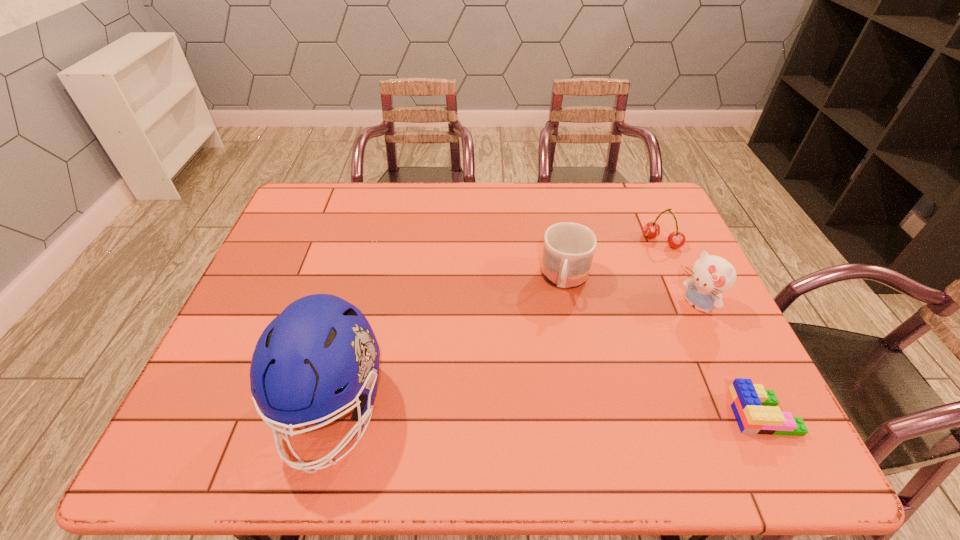
Find the location of `the tallest object`. the tallest object is located at coordinates (320, 355).

The image size is (960, 540). Find the location of `football helmet`. football helmet is located at coordinates (320, 355).

Locate an element on the screen. Image resolution: width=960 pixels, height=540 pixels. Lego is located at coordinates (755, 408).

Where is `the farthest object`? the farthest object is located at coordinates (651, 230).

The width and height of the screenshot is (960, 540). In order to click on the fourth object from right to left in this screenshot , I will do `click(568, 249)`.

This screenshot has width=960, height=540. I want to click on kitten, so click(712, 275).

You are a GUI agent. You are given a task and a screenshot of the screen. Output one action in this format:
    pyautogui.click(x=<x>, y=<y>)
    Task: Click on the free location located on the back of the shortest object
    
    Given the screenshot: What is the action you would take?
    pyautogui.click(x=691, y=268)

The height and width of the screenshot is (540, 960). What are the coordinates of `free space located with stems pointing upwards on the cherry` in the screenshot? It's located at (620, 292).

Find the location of a particular element. Image resolution: width=960 pixels, height=540 pixels. free space located 0.220m with stems pointing upwards on the cherry is located at coordinates (620, 292).

Find the location of a particular element. blank space located with stems pointing upwards on the cherry is located at coordinates (646, 259).